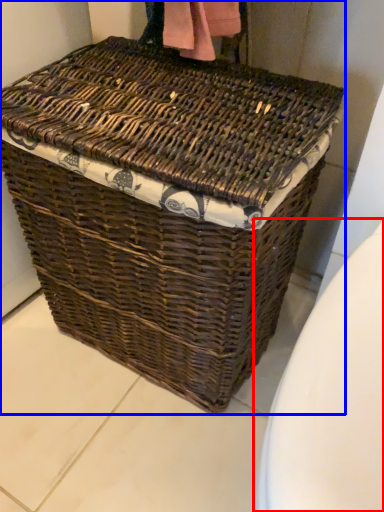
Question: Which object is further to the camera taking this photo, toilet bowl (highlighted by a red box) or picnic basket (highlighted by a blue box)?

Choices:
 (A) toilet bowl
 (B) picnic basket

Answer: (B)